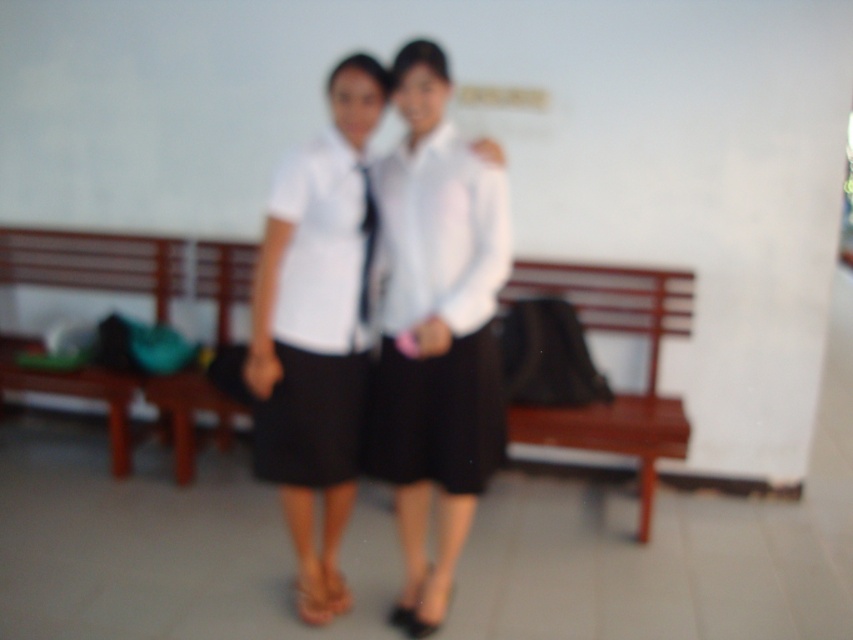
In the scene shown: You are a photographer trying to capture a photo of both the white matte shirt at center and the white matte uniform skirt at center. Since they are both at the center, how can you position your camera to ensure both are fully visible in the frame?

Since the white matte shirt at center is to the right of the white matte uniform skirt at center, you should position your camera slightly to the left of the white matte uniform skirt at center to include both objects in the frame.

You are standing in the scene and see the point at coordinates (318, 317). What object is this point located on?

The point at coordinates (318, 317) is located on the white matte uniform skirt at center.